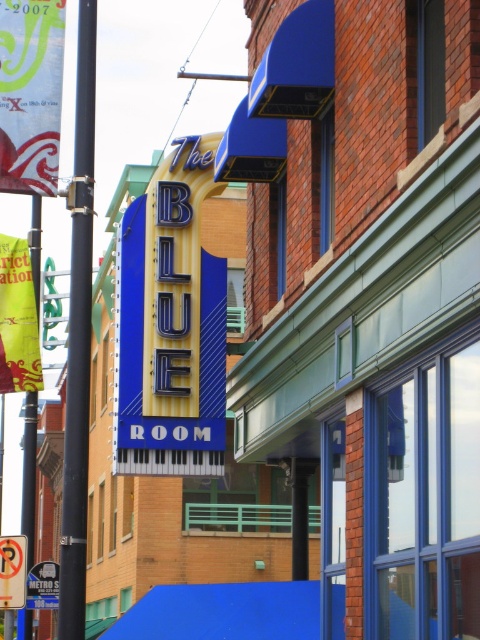
Question: Among these points, which one is farthest from the camera?

Choices:
 (A) (81, 620)
 (B) (55, 26)
 (C) (195, 637)
 (D) (51, 580)

Answer: (D)

Question: Can you confirm if blue matte awning at center is thinner than yellow fabric sign at left?

Choices:
 (A) yes
 (B) no

Answer: (B)

Question: Estimate the real-world distances between objects in this image. Which object is farther from the yellow fabric sign at left?

Choices:
 (A) metallic silver bus stop sign at center
 (B) blue matte awning at center
 (C) black metal pole at left
 (D) green fabric sign at upper left

Answer: (A)

Question: Is black metal pole at left wider than green fabric sign at upper left?

Choices:
 (A) no
 (B) yes

Answer: (B)

Question: Can you confirm if black metal pole at left is positioned above yellow fabric sign at left?

Choices:
 (A) no
 (B) yes

Answer: (A)

Question: Which object is positioned closest to the green fabric sign at upper left?

Choices:
 (A) metallic silver bus stop sign at center
 (B) black metal pole at left

Answer: (B)